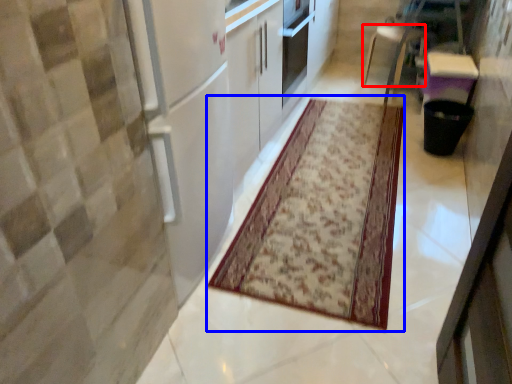
Question: Which point is closer to the camera, furniture (highlighted by a red box) or mat (highlighted by a blue box)?

Choices:
 (A) furniture
 (B) mat

Answer: (B)